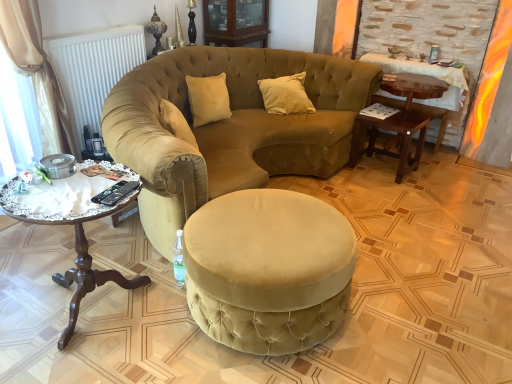
Find the location of a particular element. This screenshot has width=512, height=384. vacant space underneath woodenwoodencoffee table at left (from a real-world perspective) is located at coordinates (97, 310).